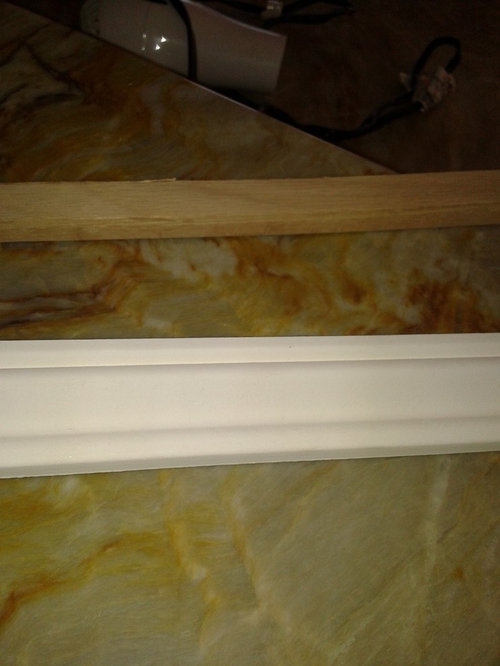
You are a GUI agent. You are given a task and a screenshot of the screen. Output one action in this format:
    pyautogui.click(x=<x>, y=<y>)
    Task: Click on the black cable around the hairdryer plastic casing
    The width and height of the screenshot is (500, 666).
    Given the screenshot: What is the action you would take?
    pyautogui.click(x=189, y=26)